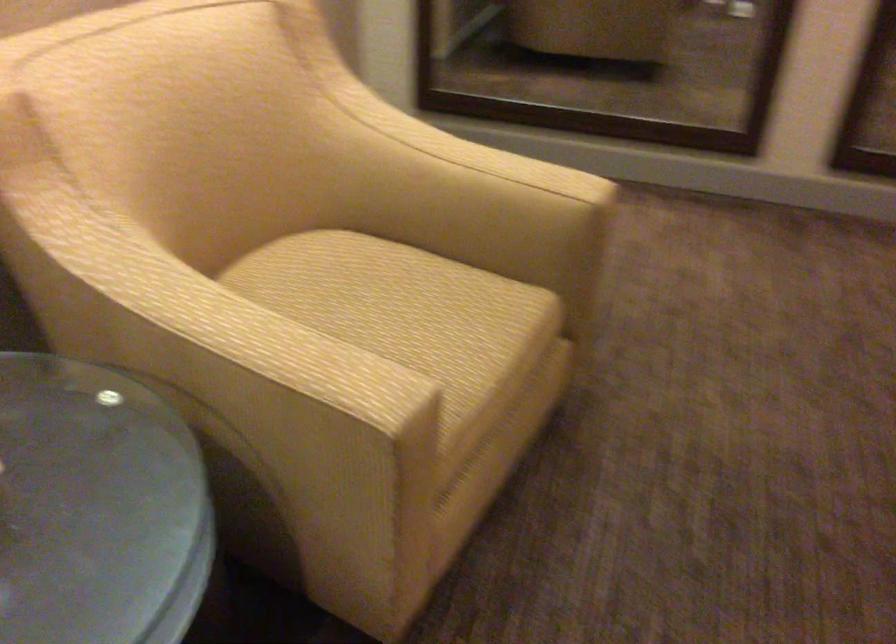
Identify the location of chair sitting surface. Image resolution: width=896 pixels, height=644 pixels. (403, 310).